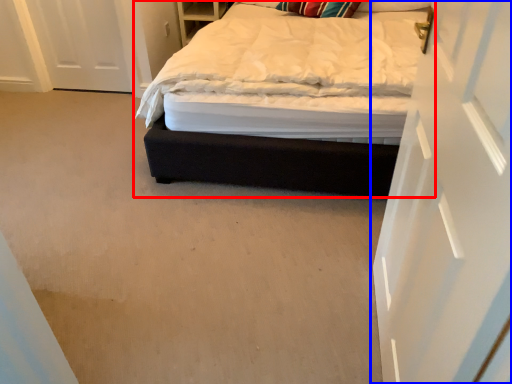
Question: Which point is closer to the camera, bed (highlighted by a red box) or door (highlighted by a blue box)?

Choices:
 (A) bed
 (B) door

Answer: (B)